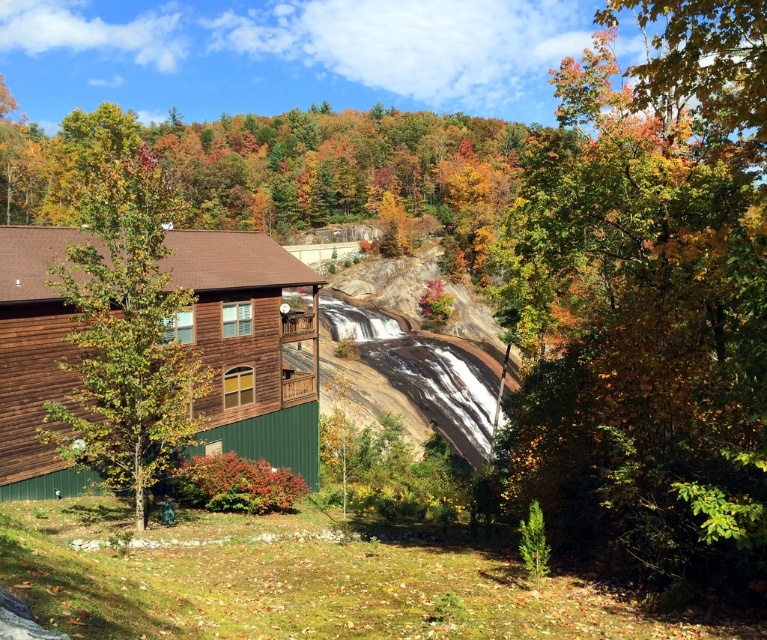
Measure the distance from autumn leaves at right to green matte tree at center.

They are 17.49 meters apart.

Can you confirm if autumn leaves at right is positioned above green matte tree at center?

Yes, autumn leaves at right is above green matte tree at center.

This screenshot has width=767, height=640. What do you see at coordinates (649, 298) in the screenshot?
I see `autumn leaves at right` at bounding box center [649, 298].

The image size is (767, 640). I want to click on autumn leaves at right, so click(x=649, y=298).

Is brown wood cabin at left to the right of green matte tree at center from the viewer's perspective?

Indeed, brown wood cabin at left is positioned on the right side of green matte tree at center.

Does brown wood cabin at left appear on the left side of green matte tree at center?

Incorrect, brown wood cabin at left is not on the left side of green matte tree at center.

Between point (58, 232) and point (94, 444), which one is positioned behind?

The point (58, 232) is more distant.

This screenshot has height=640, width=767. What are the coordinates of `brown wood cabin at left` in the screenshot? It's located at click(x=249, y=346).

The height and width of the screenshot is (640, 767). Describe the element at coordinates (649, 298) in the screenshot. I see `autumn leaves at right` at that location.

Identify the location of autumn leaves at right. (649, 298).